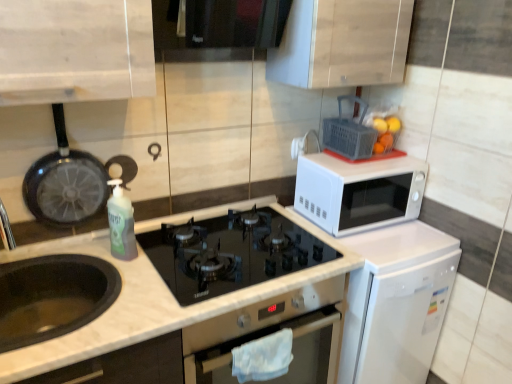
Question: From a real-world perspective, is wooden cabinet at upper center positioned above or below white plastic electric outlet at upper right?

Choices:
 (A) above
 (B) below

Answer: (A)

Question: Is wooden cabinet at upper center inside the boundaries of white plastic electric outlet at upper right, or outside?

Choices:
 (A) outside
 (B) inside

Answer: (A)

Question: Which object is positioned closest to the metallic silver oven at center?

Choices:
 (A) translucent plastic bottle at center-left
 (B) white plastic electric outlet at upper right
 (C) white matte dishwasher at right
 (D) black glass gas stove at center
 (E) black matte frying pan at left

Answer: (C)

Question: Estimate the real-world distances between objects in this image. Which object is farther from the translucent plastic bottle at center-left?

Choices:
 (A) translucent plastic basket at upper right
 (B) black glass gas stove at center
 (C) white matte dishwasher at right
 (D) black matte frying pan at left
 (E) wooden cabinet at upper center

Answer: (C)